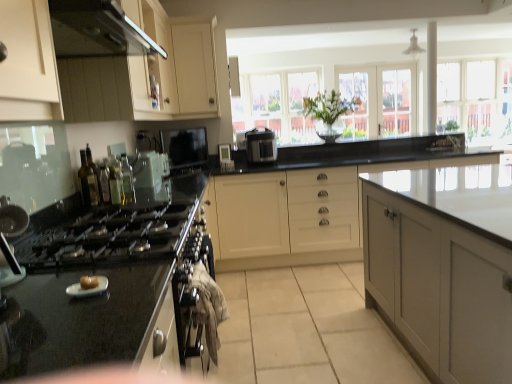
Question: Choose the correct answer: Is green glass bottle at left, which is the 2th bottle in front-to-back order, inside clear glass window at upper right or outside it?

Choices:
 (A) inside
 (B) outside

Answer: (B)

Question: In terms of height, does green glass bottle at left, which ranks as the 3th bottle in back-to-front order, look taller or shorter compared to clear glass window at upper right?

Choices:
 (A) tall
 (B) short

Answer: (B)

Question: Which is nearer to the clear glass window at upper center, which appears as the 2th window screen when viewed from the left?

Choices:
 (A) clear glass bottle at left, positioned as the second appliance in front-to-back order
 (B) clear glass bottle at left, which ranks as the 3th bottle in front-to-back order
 (C) green glass bottle at left, the fourth bottle when ordered from back to front
 (D) matte black sink at left, acting as the 2th appliance starting from the left
 (E) satin black exhaust hood at upper left

Answer: (A)

Question: Estimate the real-world distances between objects in this image. Which object is farther from the clear glass door at upper center, which ranks as the first glass door in left-to-right order?

Choices:
 (A) satin black exhaust hood at upper left
 (B) translucent glass bottles at left, which is the 1th bottle in back-to-front order
 (C) clear glass window at upper center, which appears as the 2th window screen when viewed from the left
 (D) clear glass bottle at left, the 2th appliance from the top
 (E) black glossy stovetop at left

Answer: (E)